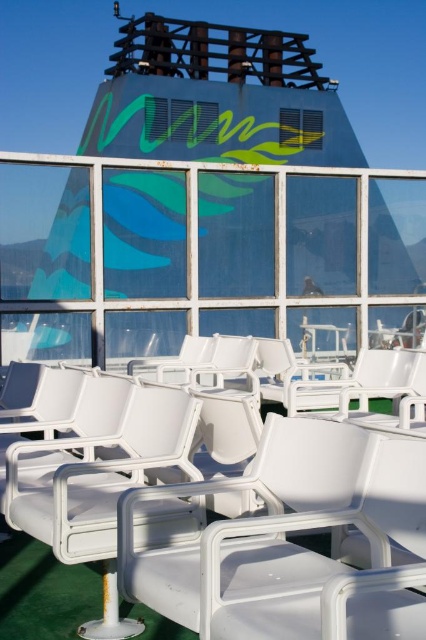
Question: Which point appears farthest from the camera in this image?

Choices:
 (A) click(201, 326)
 (B) click(322, 525)

Answer: (A)

Question: Observing the image, what is the correct spatial positioning of white plastic chairs at center in reference to white plastic chair at center?

Choices:
 (A) above
 (B) below

Answer: (A)

Question: Is white plastic chairs at center to the left of white plastic chair at center from the viewer's perspective?

Choices:
 (A) yes
 (B) no

Answer: (A)

Question: Is the position of white plastic chairs at center more distant than that of white plastic chair at center?

Choices:
 (A) yes
 (B) no

Answer: (A)

Question: Among these points, which one is farthest from the camera?

Choices:
 (A) (233, 285)
 (B) (394, 508)

Answer: (A)

Question: Which of the following is the farthest from the observer?

Choices:
 (A) white plastic chair at center
 (B) white plastic chairs at center

Answer: (B)